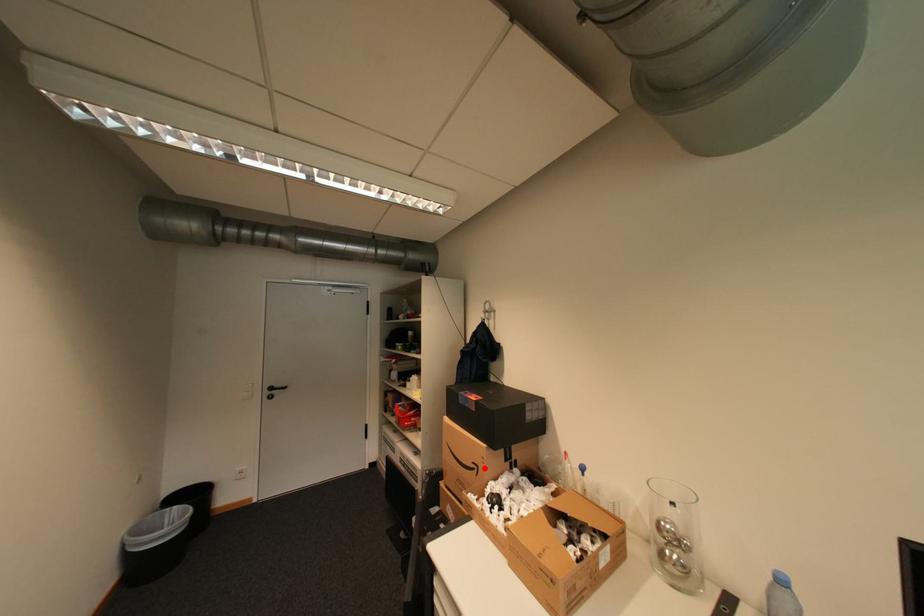
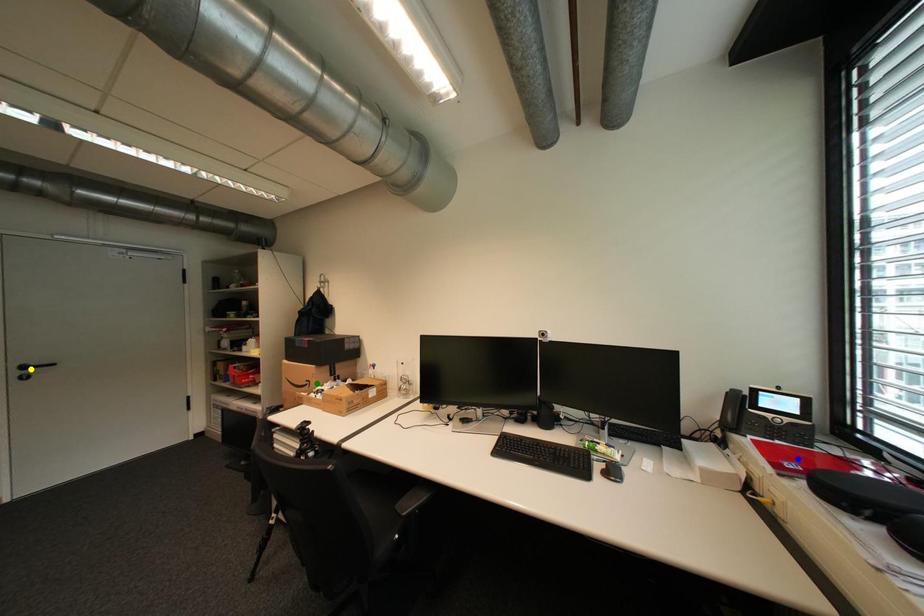
Question: I am providing you with two images of the same scene from different viewpoints. A red point is marked on the first image. You are given multiple points on the second image. Which point in image 2 represents the same 3d spot as the red point in image 1?

Choices:
 (A) blue point
 (B) green point
 (C) yellow point

Answer: (B)